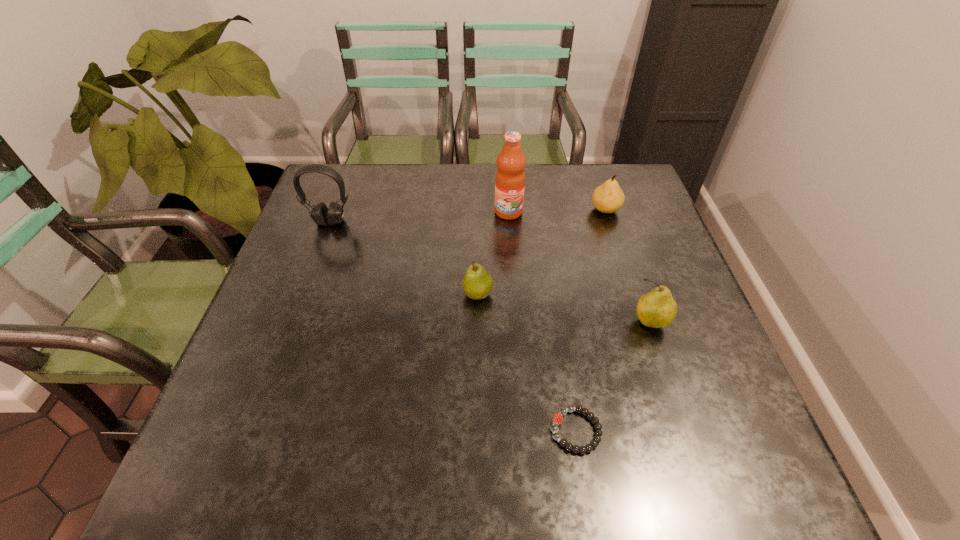
The width and height of the screenshot is (960, 540). I want to click on free point located 0.340m on the front label of the third object from left to right, so click(x=516, y=315).

You are a GUI agent. You are given a task and a screenshot of the screen. Output one action in this format:
    pyautogui.click(x=<x>, y=<y>)
    Task: Click on the vacant point located 0.120m on the front-facing side of the headset
    
    Given the screenshot: What is the action you would take?
    pyautogui.click(x=317, y=258)

The width and height of the screenshot is (960, 540). Identify the location of vacant space located 0.160m on the left of the farthest pear. (535, 210).

At what (x,y) coordinates should I click in order to perform the action: click on vacant point located 0.290m on the back of the fifth farthest object. Please return your answer as a coordinate pair (x, y). Looking at the image, I should click on (618, 229).

This screenshot has width=960, height=540. Find the location of `vacant space positioned 0.370m on the right of the second nearest pear`. vacant space positioned 0.370m on the right of the second nearest pear is located at coordinates (649, 294).

You are a GUI agent. You are given a task and a screenshot of the screen. Output one action in this format:
    pyautogui.click(x=<x>, y=<y>)
    Task: Click on the free spot located on the back of the shortest object
    Image resolution: width=960 pixels, height=540 pixels.
    Given the screenshot: What is the action you would take?
    click(552, 276)

Locate an element on the screen. This screenshot has height=540, width=960. fruit juice that is positioned at the far edge is located at coordinates (510, 177).

Identify the location of pear at the far edge. The width and height of the screenshot is (960, 540). (607, 198).

I want to click on object located in the near edge section of the desktop, so click(x=558, y=418).

Image resolution: width=960 pixels, height=540 pixels. I want to click on object positioned at the left edge, so click(x=321, y=215).